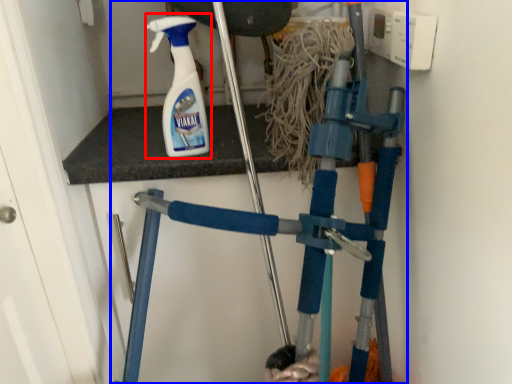
Question: Which point is further to the camera, cleaning product (highlighted by a red box) or crutch (highlighted by a blue box)?

Choices:
 (A) cleaning product
 (B) crutch

Answer: (B)